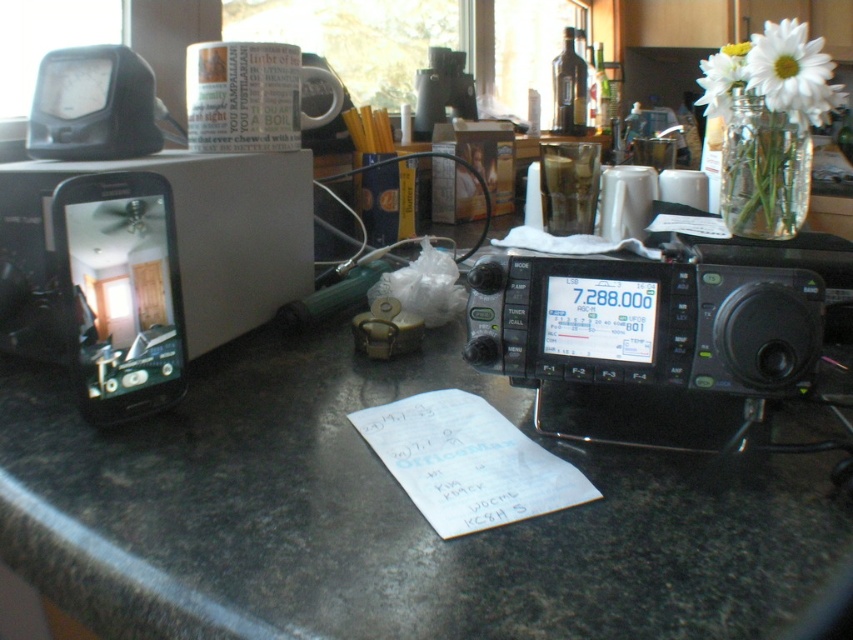
Question: Can you confirm if black plastic radio at center is bigger than black plastic smartphone at left?

Choices:
 (A) no
 (B) yes

Answer: (B)

Question: Based on their relative distances, which object is farther from the black plastic smartphone at left?

Choices:
 (A) black granite countertop at center
 (B) white matte flower at upper right

Answer: (B)

Question: Can you confirm if black granite countertop at center is thinner than white matte flower at upper right?

Choices:
 (A) no
 (B) yes

Answer: (A)

Question: Which object appears farthest from the camera in this image?

Choices:
 (A) white matte vase at upper right
 (B) black plastic radio at center

Answer: (A)

Question: Is black granite countertop at center positioned in front of black plastic smartphone at left?

Choices:
 (A) no
 (B) yes

Answer: (B)

Question: Which object appears farthest from the camera in this image?

Choices:
 (A) black plastic radio at center
 (B) black granite countertop at center

Answer: (A)